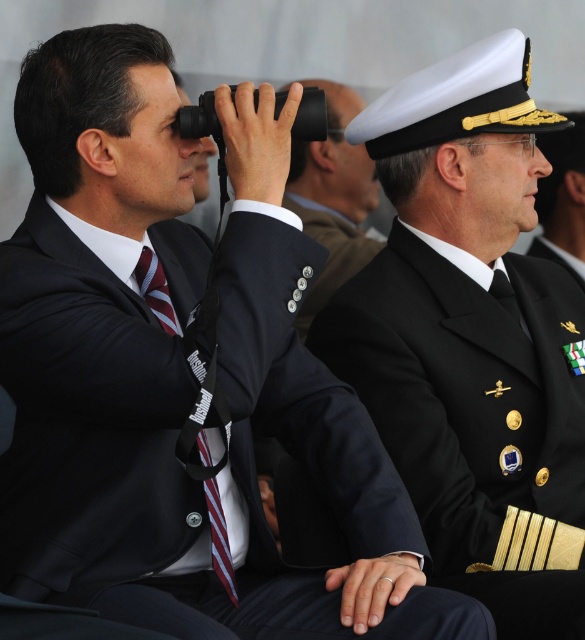
You are standing in front of a painting that shows two people seated at a formal event. One is wearing a dark suit with a name tag, and the other is in a naval uniform. The black matte uniform at center is part of the naval officer. You want to take a closer look at the medals on the naval uniform without moving your position. Which part of the uniform should you focus on to see the medals clearly?

The medals are located on the black matte uniform at center, so focusing on that area will allow you to see them clearly.

Based on the photo, you are a photographer at a formal event and need to capture a clear photo of the striped fabric tie at center without the matte black binoculars at center obstructing it. How should you adjust your camera angle?

The striped fabric tie at center is behind the matte black binoculars at center. To avoid obstruction, you should angle the camera slightly downward so that the binoculars no longer block the view of the tie.